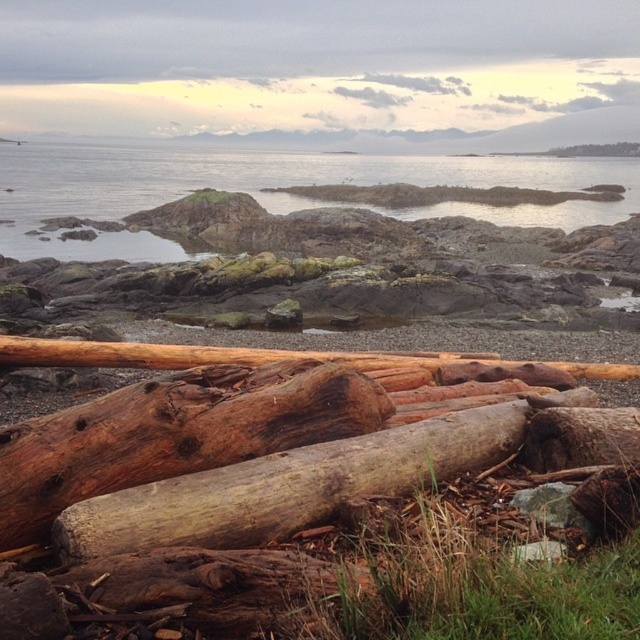
Question: Which point appears closest to the camera in this image?

Choices:
 (A) (628, 156)
 (B) (288, 484)
 (C) (179, 193)

Answer: (B)

Question: Can you confirm if clear water at center is wider than brown rough wood at center?

Choices:
 (A) yes
 (B) no

Answer: (A)

Question: Which point is closer to the camera?

Choices:
 (A) (506, 168)
 (B) (566, 147)
 (C) (228, 531)

Answer: (C)

Question: Does brown rough wood at center have a lesser width compared to brown rough wood at upper right?

Choices:
 (A) yes
 (B) no

Answer: (B)

Question: Does clear water at center appear over brown rough wood at upper right?

Choices:
 (A) yes
 (B) no

Answer: (B)

Question: Among these objects, which one is farthest from the camera?

Choices:
 (A) clear water at center
 (B) brown rough wood at center

Answer: (A)